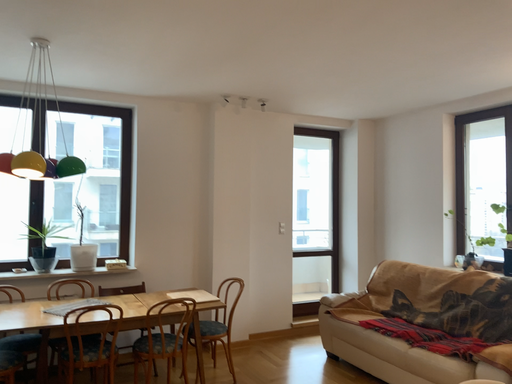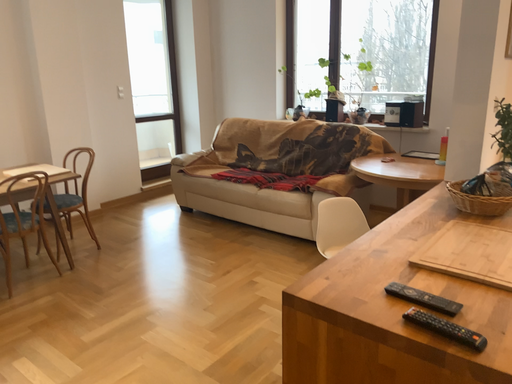
Question: How did the camera likely rotate when shooting the video?

Choices:
 (A) rotated downward
 (B) rotated upward

Answer: (A)